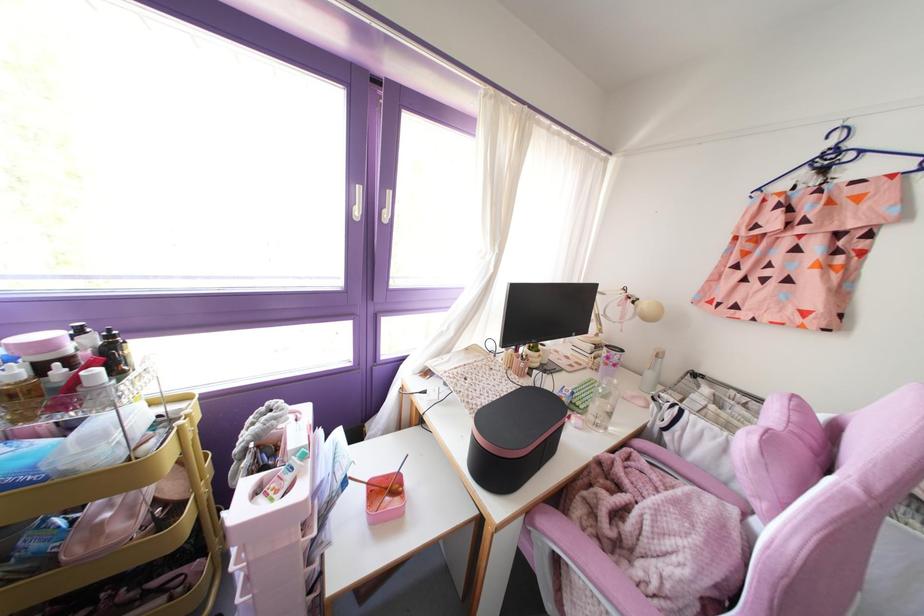
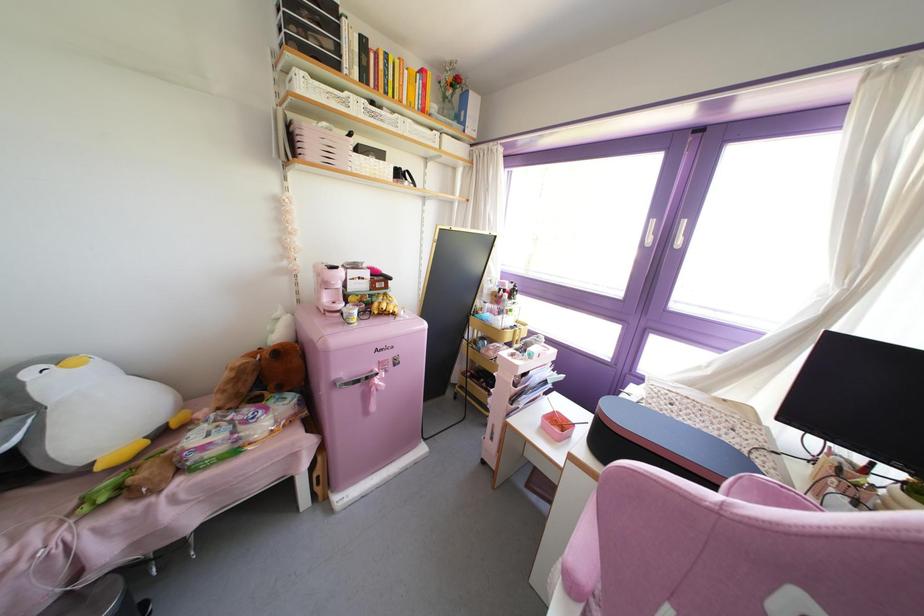
The point at [359,188] is marked in the first image. Where is the corresponding point in the second image?

(652, 222)